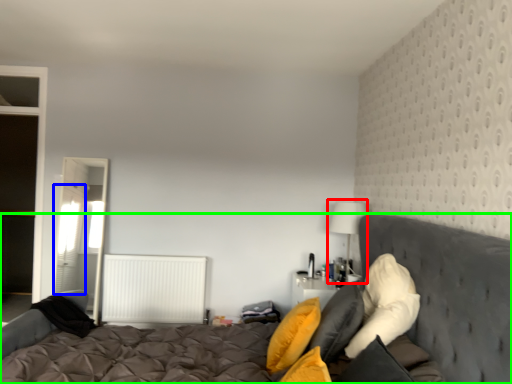
Question: Estimate the real-world distances between objects in this image. Which object is farther from table lamp (highlighted by a red box), curtain (highlighted by a blue box) or bed (highlighted by a green box)?

Choices:
 (A) curtain
 (B) bed

Answer: (A)